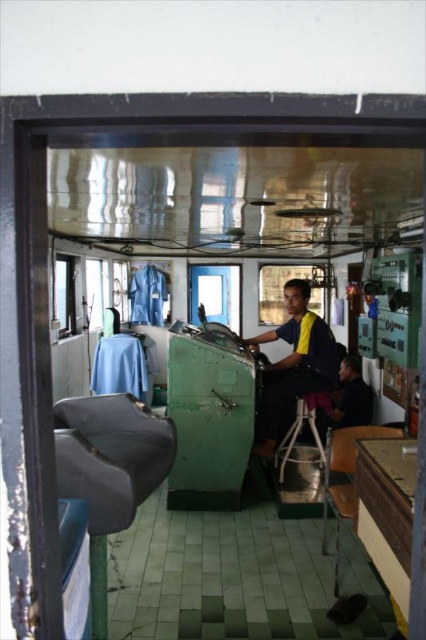
You are a maintenance technician needing to reach the wooden chair at lower right from the matte gray plastic chair at left. The technician is carrying a tool box that is 1.2 meters long. Is there enough space to move the toolbox between the two chairs without tilting it?

The distance between the matte gray plastic chair at left and wooden chair at lower right is 1.50 meters. Since the toolbox is 1.2 meters long, there is sufficient space to move it horizontally between the chairs without tilting.

You are a visitor on the ship and need to sit down. You see a wooden chair at lower right and a metallic silver stool at center. Which one is closer to you?

The wooden chair at lower right is closer to you because it is in front of the metallic silver stool at center.

You are navigating a ship and need to reach the emergency exit located at point (299, 461). There is an obstacle at point (336, 593) blocking your path. Can you safely move around the obstacle to reach the exit?

Point (336, 593) is in front of point (299, 461), so the obstacle is blocking the path. You need to move around it to reach the exit safely.